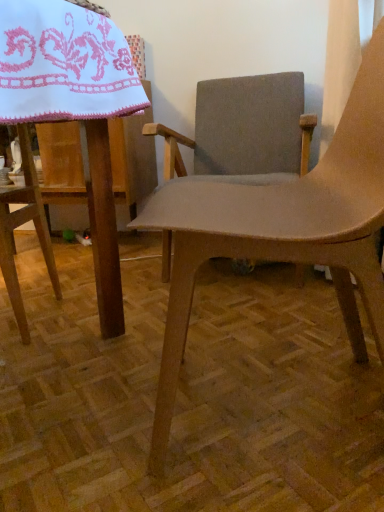
Find the location of a particular element. This screenshot has height=512, width=384. vacant space underneath matte brown chair at center, the second chair positioned from the back (from a real-world perspective) is located at coordinates (281, 409).